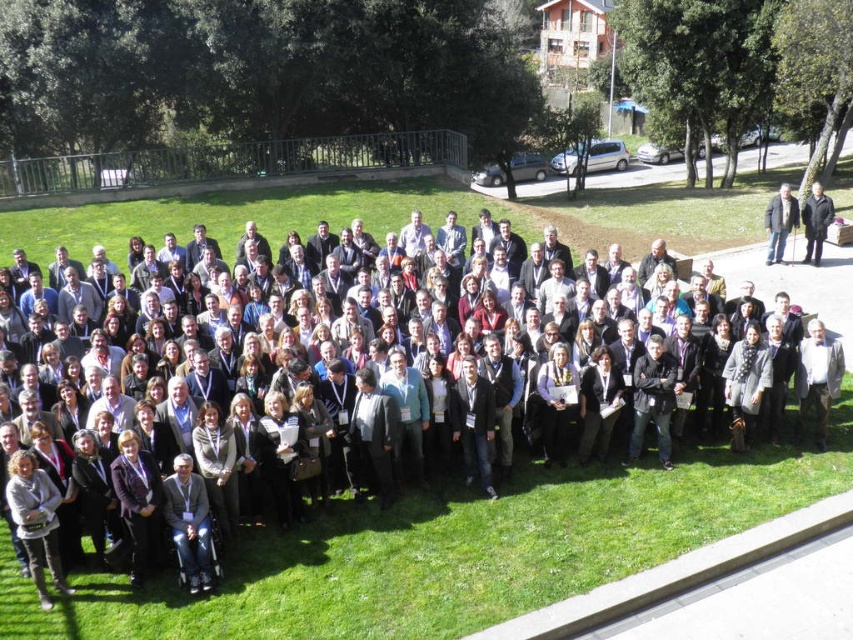
Question: Estimate the real-world distances between objects in this image. Which object is closer to the dark gray suit at center?

Choices:
 (A) black wool coat at right
 (B) light brown wool sweater at lower left
 (C) dark gray suit at right

Answer: (B)

Question: Which object is the closest to the dark gray suit at center?

Choices:
 (A) dark gray suit at right
 (B) black wool coat at right
 (C) light brown wool sweater at lower left

Answer: (C)

Question: Can you confirm if light brown wool sweater at lower left is thinner than black wool coat at right?

Choices:
 (A) no
 (B) yes

Answer: (B)

Question: Which point appears closest to the camera in this image?

Choices:
 (A) (732, 461)
 (B) (817, 212)

Answer: (A)

Question: Does dark gray suit at center have a greater width compared to light brown wool sweater at lower left?

Choices:
 (A) no
 (B) yes

Answer: (B)

Question: Does dark gray suit at right have a lesser width compared to black wool coat at right?

Choices:
 (A) yes
 (B) no

Answer: (B)